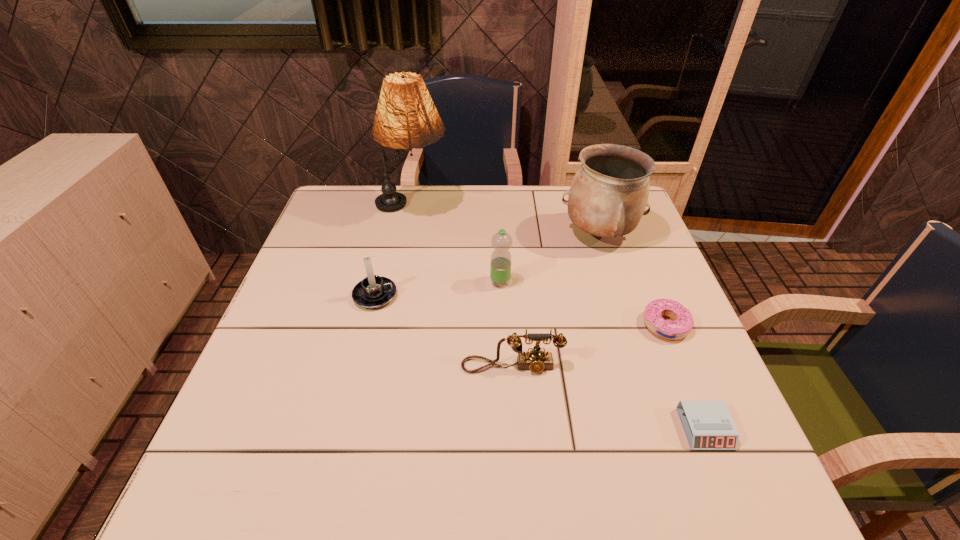
This screenshot has width=960, height=540. Find the location of `free space between the tallest object and the nearest object`. free space between the tallest object and the nearest object is located at coordinates (559, 319).

The width and height of the screenshot is (960, 540). Find the location of `unoccupied area between the candle holder and the tallest object`. unoccupied area between the candle holder and the tallest object is located at coordinates (394, 252).

Locate an element on the screen. Image resolution: width=960 pixels, height=540 pixels. free space between the second tallest object and the tallest object is located at coordinates (505, 221).

This screenshot has width=960, height=540. What are the coordinates of `free spot between the sixth tallest object and the telephone` in the screenshot? It's located at (588, 346).

You are a GUI agent. You are given a task and a screenshot of the screen. Output one action in this format:
    pyautogui.click(x=<x>, y=<y>)
    Task: Click on the free space between the sixth tallest object and the shortest object
    
    Given the screenshot: What is the action you would take?
    pyautogui.click(x=685, y=377)

The width and height of the screenshot is (960, 540). I want to click on empty space that is in between the fifth tallest object and the candle holder, so click(x=444, y=331).

You are a GUI agent. You are given a task and a screenshot of the screen. Output one action in this format:
    pyautogui.click(x=<x>, y=<y>)
    Task: Click on the vacant area between the candle holder and the water bottle
    The height and width of the screenshot is (540, 960).
    Given the screenshot: What is the action you would take?
    pyautogui.click(x=438, y=289)

The width and height of the screenshot is (960, 540). Identify the location of vacant space that is in between the candle holder and the urn. (487, 265).

Identify which object is located as the fifth nearest to the nearest object. Please provide its 2D coordinates. Your answer should be formatted as a tuple, i.e. [(x, y)], where the tuple contains the x and y coordinates of a point satisfying the conditions above.

[(374, 291)]

Identify which object is located as the nearest to the tallest object. Please provide its 2D coordinates. Your answer should be formatted as a tuple, i.e. [(x, y)], where the tuple contains the x and y coordinates of a point satisfying the conditions above.

[(374, 291)]